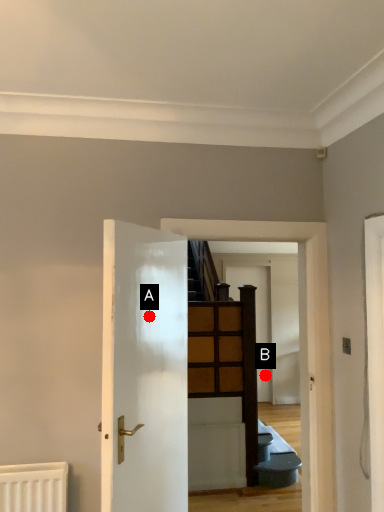
Question: Two points are circled on the image, labeled by A and B beside each circle. Which point is closer to the camera taking this photo?

Choices:
 (A) A is closer
 (B) B is closer

Answer: (A)